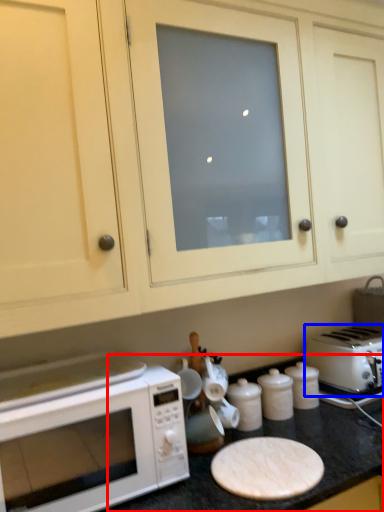
Question: Which object is further to the camera taking this photo, counter top (highlighted by a red box) or toaster (highlighted by a blue box)?

Choices:
 (A) counter top
 (B) toaster

Answer: (B)